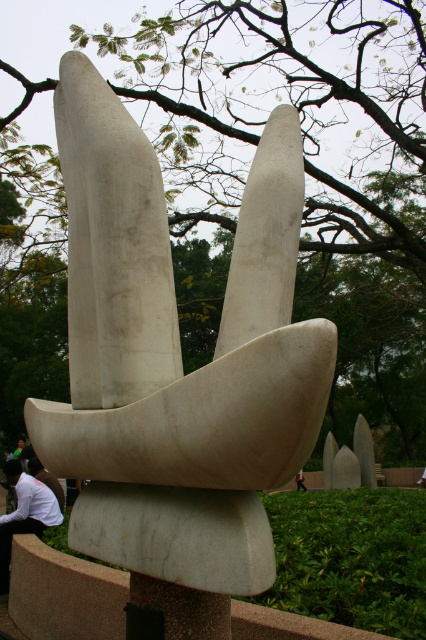
Question: Can you confirm if white marble sculpture at center is positioned above white shirt at lower left?

Choices:
 (A) yes
 (B) no

Answer: (A)

Question: Which point is farther from the camera taking this photo?

Choices:
 (A) 261,212
 (B) 29,531

Answer: (B)

Question: Is white marble sculpture at center below white shirt at lower left?

Choices:
 (A) no
 (B) yes

Answer: (A)

Question: Is white marble sculpture at center to the right of white shirt at lower left from the viewer's perspective?

Choices:
 (A) no
 (B) yes

Answer: (B)

Question: Which point is farther to the camera?

Choices:
 (A) (218, 435)
 (B) (28, 497)

Answer: (B)

Question: Among these objects, which one is farthest from the camera?

Choices:
 (A) white shirt at lower left
 (B) white marble sculpture at center

Answer: (A)